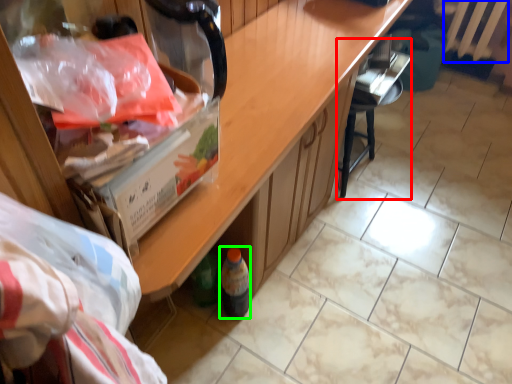
Question: Which object is positioned farthest from chair (highlighted by a red box)? Select from radiator (highlighted by a blue box) and wine bottle (highlighted by a green box).

Choices:
 (A) radiator
 (B) wine bottle

Answer: (A)